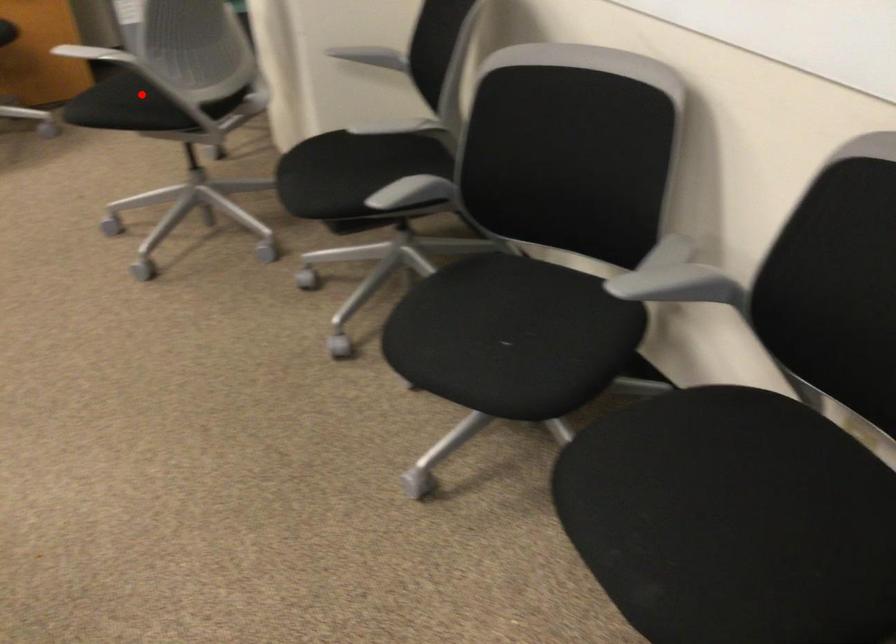
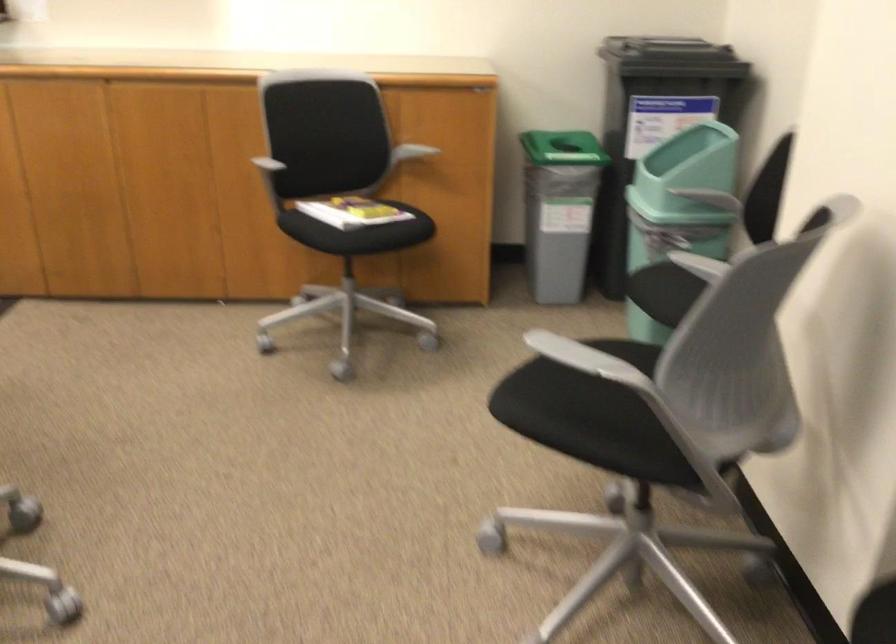
Question: I am providing you with two images of the same scene from different viewpoints. In image1, a red point is highlighted. Considering the same 3D point in image2, which of the following is correct?

Choices:
 (A) It is closer
 (B) It is farther

Answer: (A)